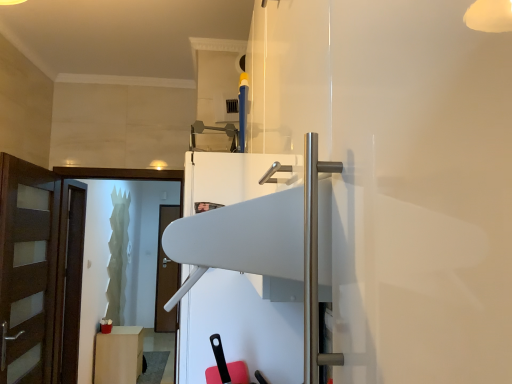
Question: From a real-world perspective, is transparent glass screen door at left physically located above or below brown wooden door at left?

Choices:
 (A) above
 (B) below

Answer: (A)

Question: Considering their positions, is transparent glass screen door at left located in front of or behind brown wooden door at left?

Choices:
 (A) front
 (B) behind

Answer: (A)

Question: Which is nearer to the matte white cabinet at lower left?

Choices:
 (A) transparent glass screen door at left
 (B) brown wooden door at left
 (C) white glossy fridge at center

Answer: (B)

Question: Which is nearer to the brown wooden door at left?

Choices:
 (A) white glossy fridge at center
 (B) matte white cabinet at lower left
 (C) transparent glass screen door at left

Answer: (C)